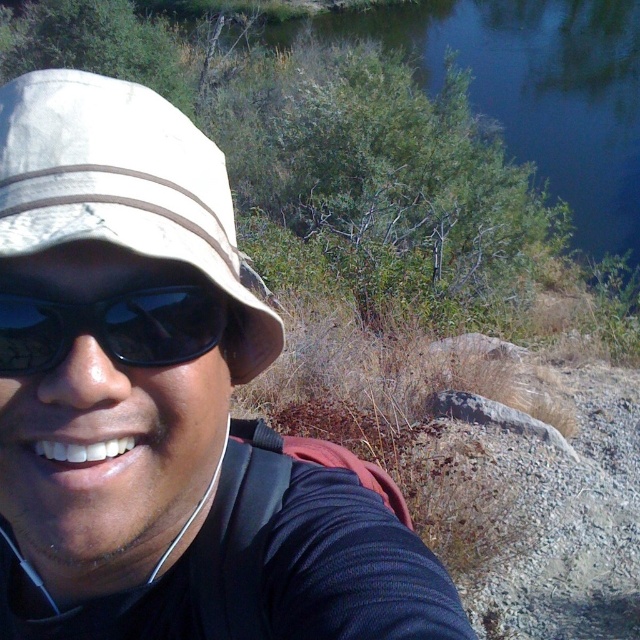
From the picture: Can you confirm if white matte hat at upper left is smaller than black matte sunglasses at left?

Incorrect, white matte hat at upper left is not smaller in size than black matte sunglasses at left.

Is point (42, 337) in front of point (205, 342)?

Yes, it is.

Is point (225, 419) positioned after point (42, 321)?

Yes.

This screenshot has height=640, width=640. Identify the location of white matte hat at upper left. (163, 404).

Does blue water at upper center appear on the left side of black matte sunglasses at left?

No, blue water at upper center is not to the left of black matte sunglasses at left.

Between blue water at upper center and black matte sunglasses at left, which one is positioned lower?

black matte sunglasses at left is below.

Locate an element on the screen. blue water at upper center is located at coordinates point(540,90).

Image resolution: width=640 pixels, height=640 pixels. Find the location of `blue water at upper center`. blue water at upper center is located at coordinates (540, 90).

Who is higher up, white matte hat at upper left or blue water at upper center?

blue water at upper center

Which is in front, point (346, 561) or point (620, 4)?

Point (346, 561) is more forward.

Locate an element on the screen. The width and height of the screenshot is (640, 640). white matte hat at upper left is located at coordinates (163, 404).